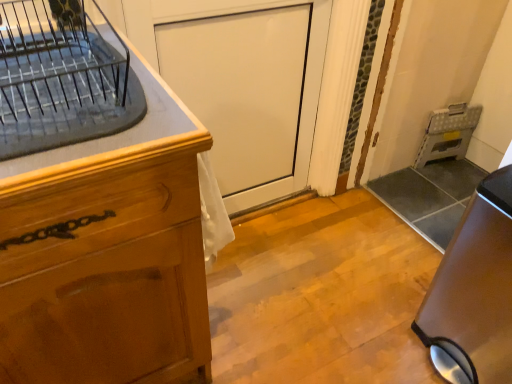
This screenshot has width=512, height=384. Identify the location of vacant area that lies to the right of metallic gray folding step stool at right. (457, 168).